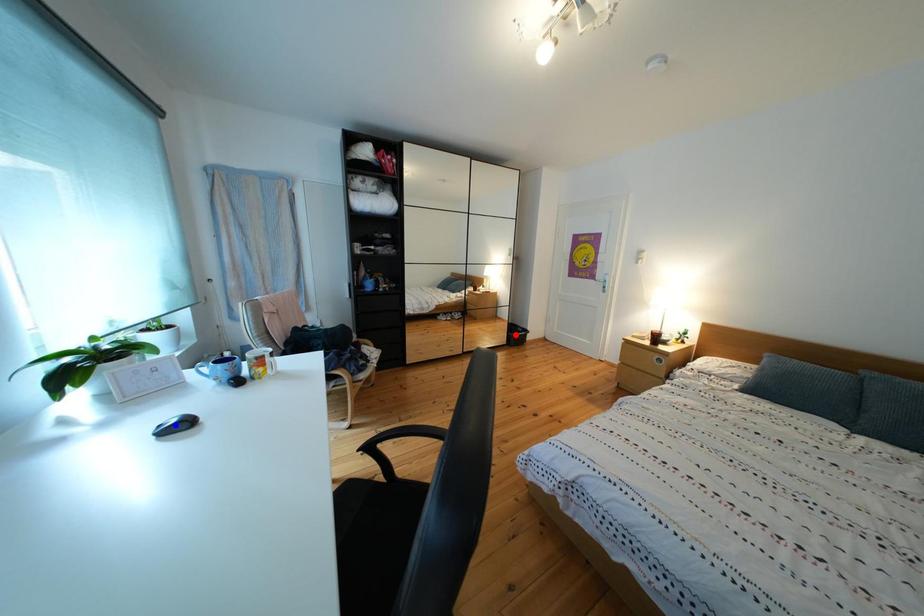
Question: Two points are marked on the image. Which point is closer to the camera?

Choices:
 (A) Blue point is closer.
 (B) Red point is closer.

Answer: (A)